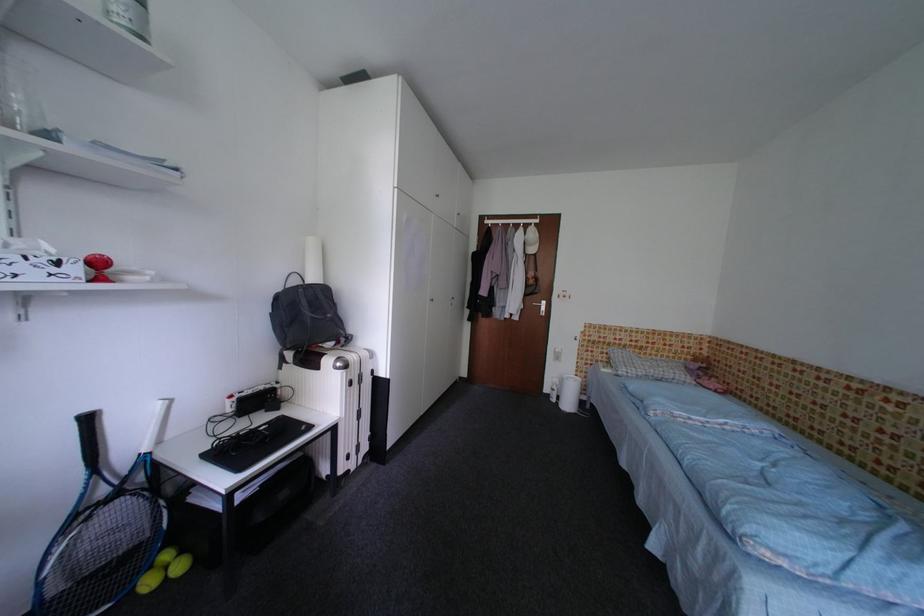
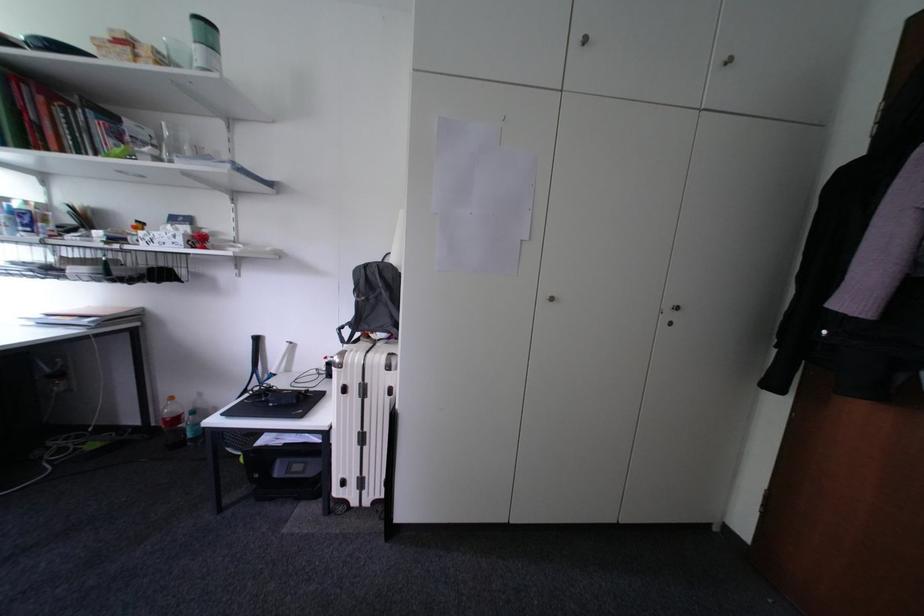
Where in the second image is the point corresponding to [359,386] from the first image?

(353, 392)